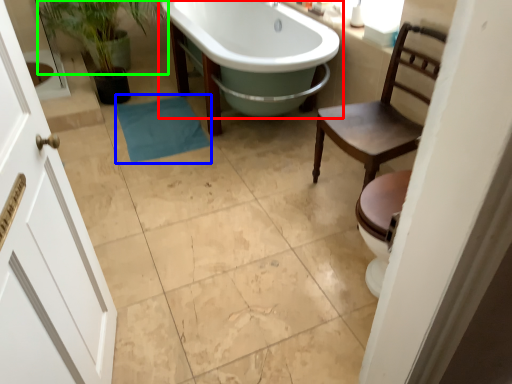
Question: Estimate the real-world distances between objects in this image. Which object is farther from bathtub (highlighted by a red box), bath towel (highlighted by a blue box) or plant (highlighted by a green box)?

Choices:
 (A) bath towel
 (B) plant

Answer: (B)